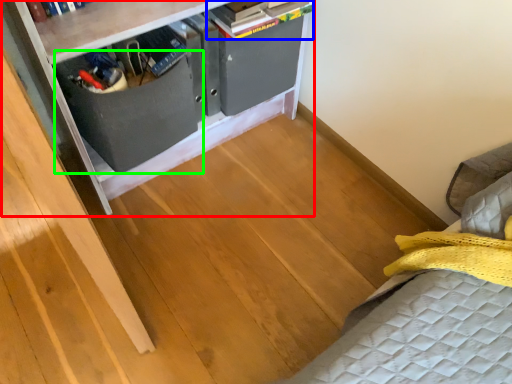
Question: Which object is positioned farthest from furniture (highlighted by a red box)? Select from book (highlighted by a blue box) and drawer (highlighted by a green box).

Choices:
 (A) book
 (B) drawer

Answer: (A)